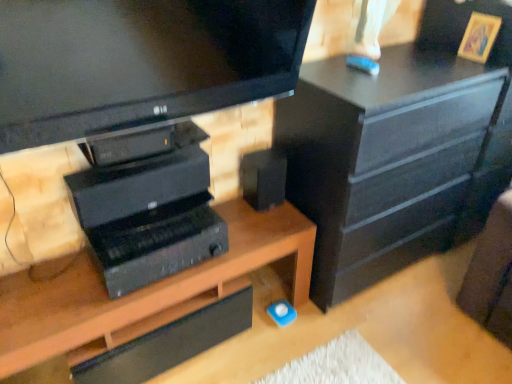
Question: Does black plastic computer at center have a greater height compared to black matte speaker at center?

Choices:
 (A) yes
 (B) no

Answer: (B)

Question: Would you consider black plastic computer at center to be distant from black matte speaker at center?

Choices:
 (A) no
 (B) yes

Answer: (A)

Question: Does black plastic computer at center have a lesser height compared to black matte speaker at center?

Choices:
 (A) yes
 (B) no

Answer: (A)

Question: Can you confirm if black plastic computer at center is bigger than black matte speaker at center?

Choices:
 (A) yes
 (B) no

Answer: (A)

Question: Is black plastic computer at center not inside black matte speaker at center?

Choices:
 (A) yes
 (B) no

Answer: (A)

Question: Considering the positions of black matte chest of drawers at upper right and wooden desk at center in the image, is black matte chest of drawers at upper right taller or shorter than wooden desk at center?

Choices:
 (A) tall
 (B) short

Answer: (A)

Question: Visually, is black matte chest of drawers at upper right positioned to the left or to the right of wooden desk at center?

Choices:
 (A) right
 (B) left

Answer: (A)

Question: In terms of width, does black matte chest of drawers at upper right look wider or thinner when compared to wooden desk at center?

Choices:
 (A) thin
 (B) wide

Answer: (B)

Question: Looking at the image, does black matte chest of drawers at upper right seem bigger or smaller compared to wooden desk at center?

Choices:
 (A) small
 (B) big

Answer: (B)

Question: In terms of height, does black matte speaker at center look taller or shorter compared to black matte chest of drawers at upper right?

Choices:
 (A) short
 (B) tall

Answer: (A)

Question: Is black matte speaker at center inside the boundaries of black matte chest of drawers at upper right, or outside?

Choices:
 (A) inside
 (B) outside

Answer: (B)

Question: From the image's perspective, is black matte speaker at center located above or below black matte chest of drawers at upper right?

Choices:
 (A) below
 (B) above

Answer: (A)

Question: Is black matte speaker at center to the left or to the right of black matte chest of drawers at upper right in the image?

Choices:
 (A) right
 (B) left

Answer: (B)

Question: Do you think wooden desk at center is within black matte speaker at center, or outside of it?

Choices:
 (A) inside
 (B) outside

Answer: (B)

Question: Is wooden desk at center taller or shorter than black matte speaker at center?

Choices:
 (A) tall
 (B) short

Answer: (A)